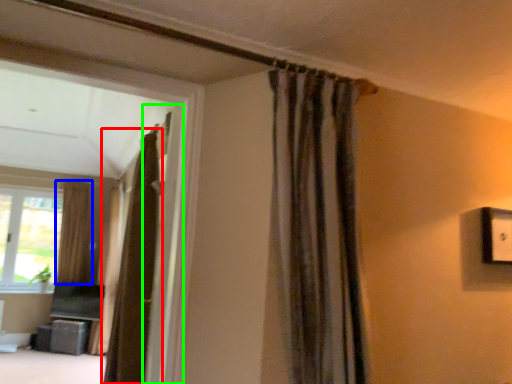
Question: Which object is the closest to the curtain (highlighted by a red box)? Choose among these: curtain (highlighted by a blue box) or screen door (highlighted by a green box).

Choices:
 (A) curtain
 (B) screen door

Answer: (B)